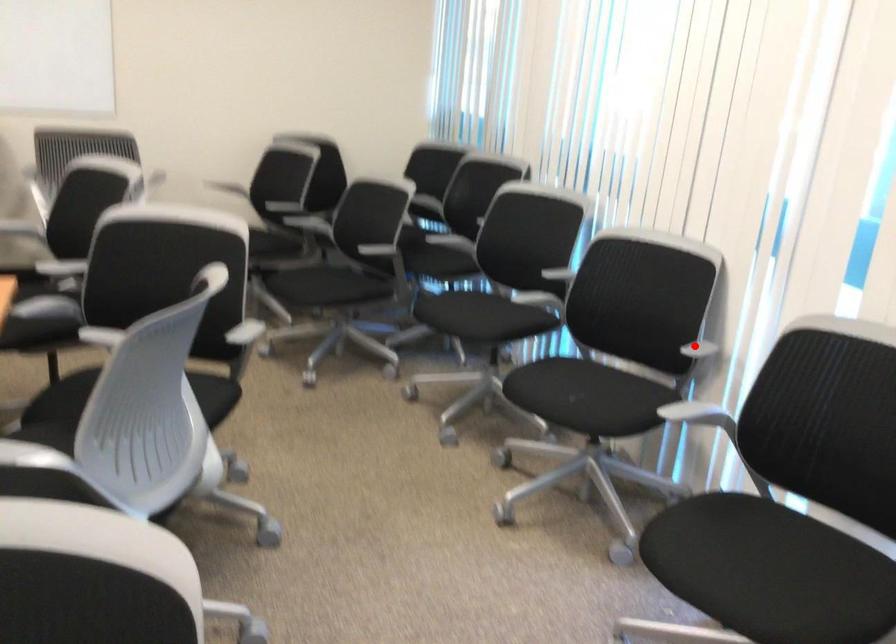
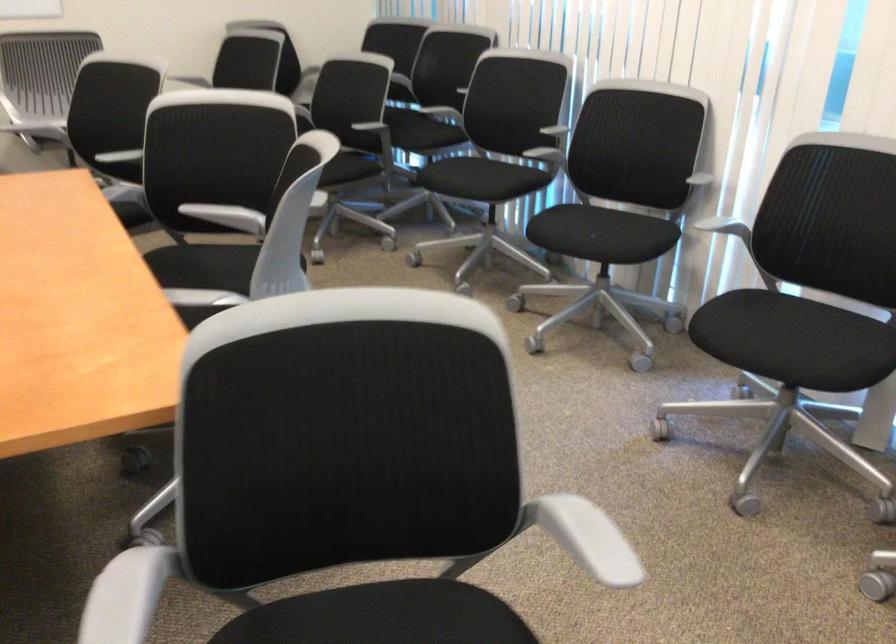
The point at the highlighted location is marked in the first image. Where is the corresponding point in the second image?

(693, 174)